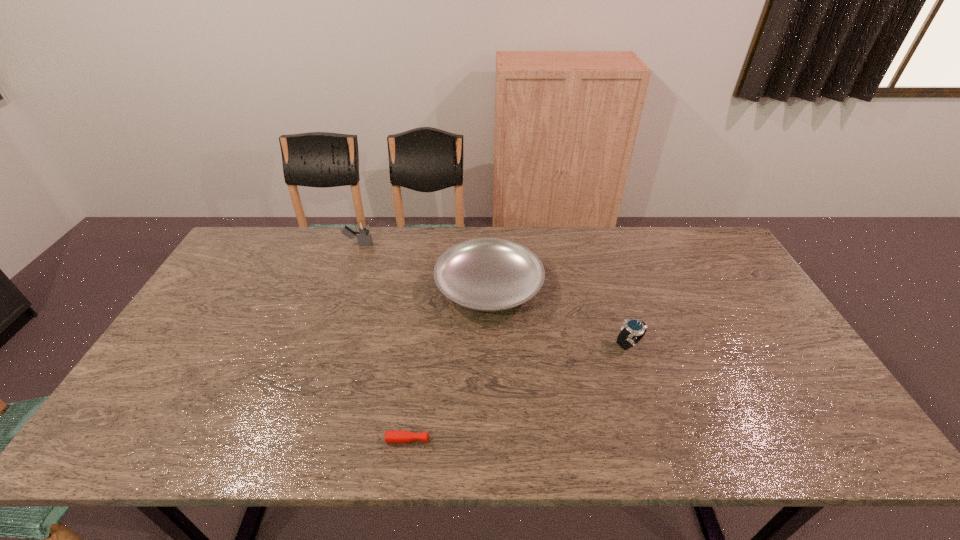
This screenshot has height=540, width=960. I want to click on free point between the watch and the screwdriver, so click(528, 392).

This screenshot has width=960, height=540. Find the location of `free space between the shortest object and the bedpan`. free space between the shortest object and the bedpan is located at coordinates (458, 363).

Locate an element on the screen. This screenshot has height=540, width=960. vacant point located between the igniter and the nearest object is located at coordinates (393, 342).

What are the coordinates of `free space that is in between the farthest object and the bedpan` in the screenshot? It's located at (423, 266).

Where is `free space between the third farthest object and the third nearest object`? Image resolution: width=960 pixels, height=540 pixels. free space between the third farthest object and the third nearest object is located at coordinates (559, 315).

The width and height of the screenshot is (960, 540). In order to click on free space between the nearest object and the tallest object in this screenshot , I will do `click(393, 342)`.

Identify the location of empty space that is in between the screwdriver and the tallest object. (393, 342).

Where is `free space between the watch and the nearest object`? The height and width of the screenshot is (540, 960). free space between the watch and the nearest object is located at coordinates (528, 392).

Identify the location of object that stands as the third closest to the third nearest object. (400, 436).

Find the location of a particular element. The image size is (960, 540). object that stands as the closest to the nearest object is located at coordinates [x=486, y=274].